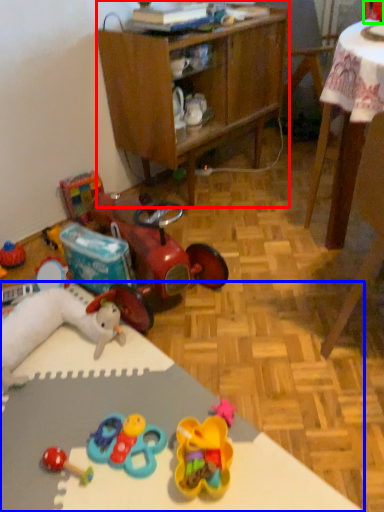
Question: Which object is the farthest from cabinetry (highlighted by a red box)? Choose among these: desk (highlighted by a blue box) or toy (highlighted by a green box).

Choices:
 (A) desk
 (B) toy

Answer: (A)